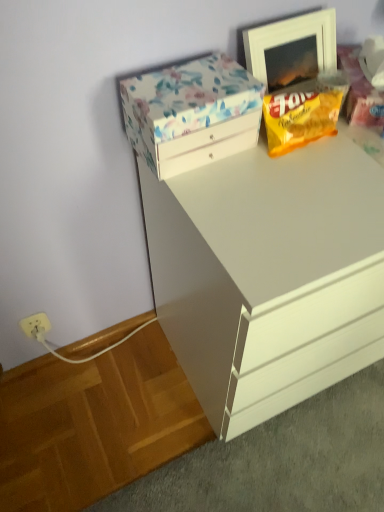
Locate an element on the screen. free space in front of yellow matte snack packet at upper right is located at coordinates (310, 188).